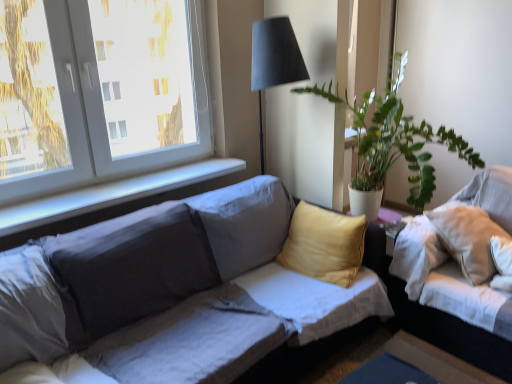
The height and width of the screenshot is (384, 512). I want to click on vacant point above white smooth window sill at upper left (from a real-world perspective), so click(120, 184).